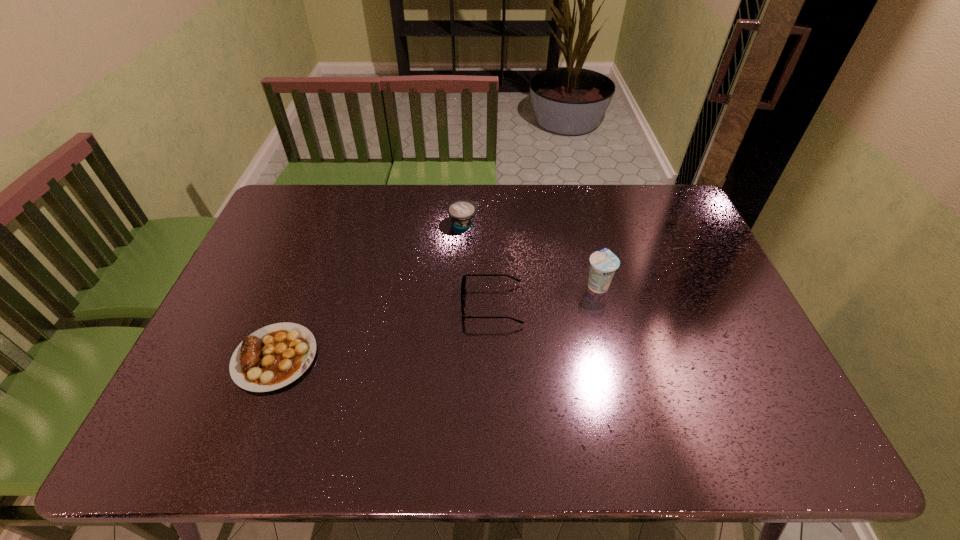
Where is `vacant space at the far right corner`? The width and height of the screenshot is (960, 540). vacant space at the far right corner is located at coordinates (657, 204).

Identify the location of vacant space in between the spectacles and the leftmost object. The image size is (960, 540). (383, 331).

What are the coordinates of `unoccupied position between the spectacles and the shorter yogurt` in the screenshot? It's located at (477, 264).

Locate an element on the screen. vacant space in between the steak and the shorter yogurt is located at coordinates (370, 290).

I want to click on vacant point located between the farthest object and the steak, so click(370, 290).

This screenshot has width=960, height=540. Find the location of `free space between the shortest object and the shorter yogurt`. free space between the shortest object and the shorter yogurt is located at coordinates (370, 290).

Where is `vacant region between the leftmost object and the shorter yogurt`? This screenshot has width=960, height=540. vacant region between the leftmost object and the shorter yogurt is located at coordinates (370, 290).

Locate an element on the screen. free point between the taller yogurt and the farther yogurt is located at coordinates (530, 254).

Locate an element on the screen. The image size is (960, 540). vacant region between the rightmost object and the spectacles is located at coordinates (544, 295).

The image size is (960, 540). Find the location of `free space between the steak and the right yogurt`. free space between the steak and the right yogurt is located at coordinates (436, 321).